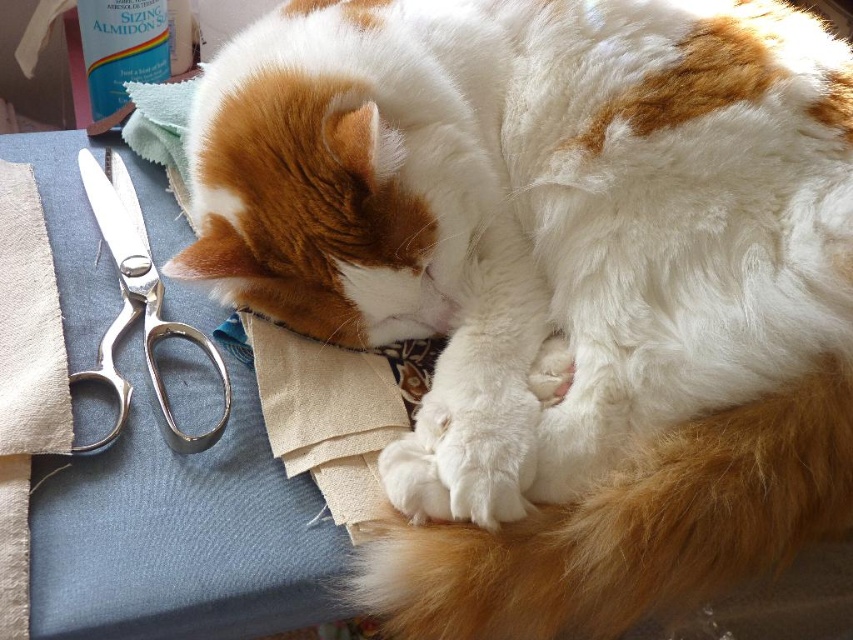
Looking at this image, you are a tailor working on a sewing project and need to reach the silver metallic scissors at left. However, there is a fluffy white fur at lower right in the way. Can you move the scissors without disturbing the cat?

The white fur at lower right is located below the silver metallic scissors at left, so you can carefully move the scissors without disturbing the cat since they are positioned above the fur.